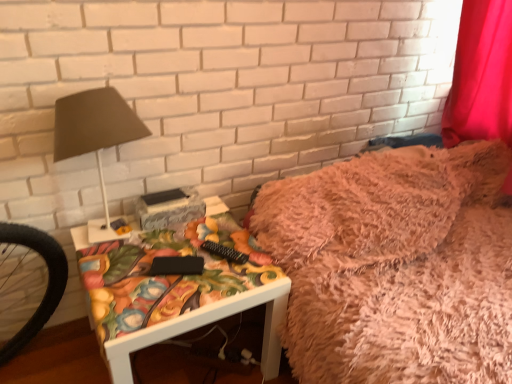
Identify the location of vacant area located to the right-hand side of matte brown lampshade at left. (196, 246).